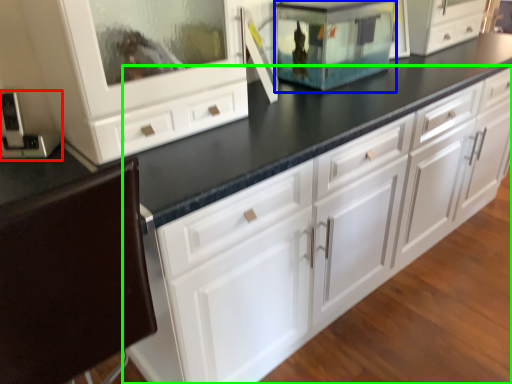
Question: Which is nearer to the appliance (highlighted by a red box)? appliance (highlighted by a blue box) or chest of drawers (highlighted by a green box).

Choices:
 (A) appliance
 (B) chest of drawers

Answer: (B)